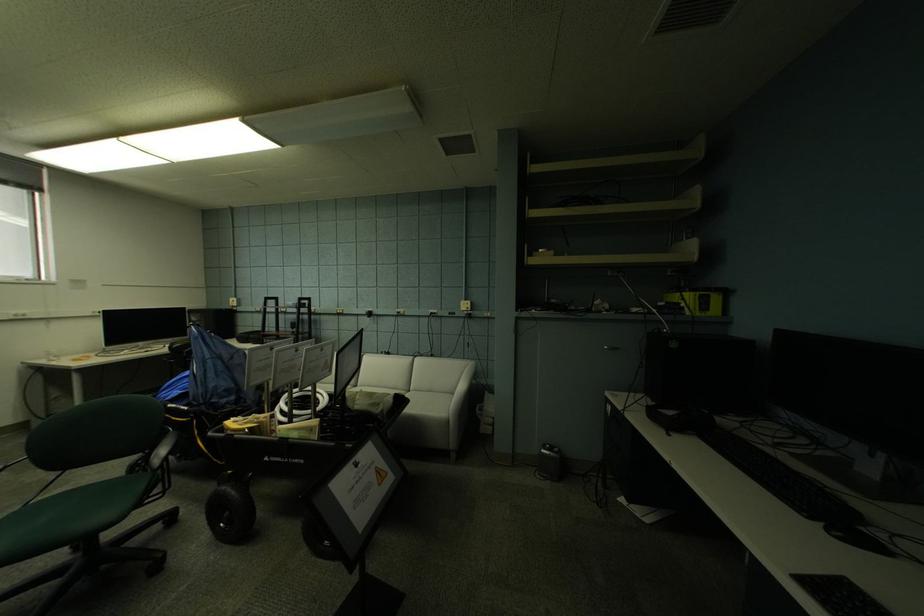
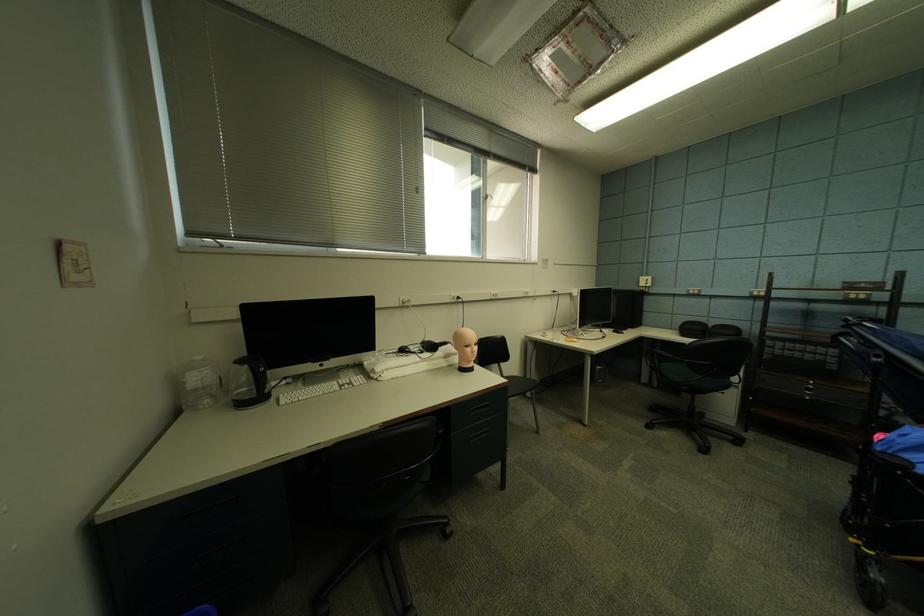
Find the pixel in the second image that matches (x=239, y=302) in the first image.

(650, 282)